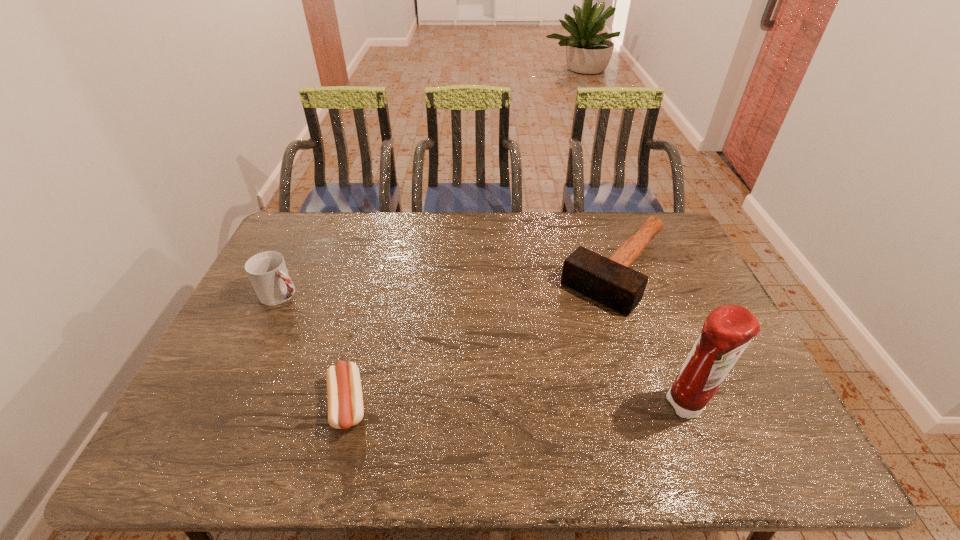
In order to click on vacant space located on the striking face of the second shortest object in this screenshot , I will do `click(531, 368)`.

The height and width of the screenshot is (540, 960). I want to click on free location located 0.390m on the side of the third shortest object where the handle is located, so click(396, 356).

The image size is (960, 540). I want to click on vacant space situated on the side of the third shortest object where the handle is located, so click(x=324, y=315).

The width and height of the screenshot is (960, 540). I want to click on vacant area situated 0.090m on the side of the third shortest object where the handle is located, so click(x=319, y=312).

I want to click on object that is positioned at the far edge, so click(609, 281).

I want to click on sausage located at the near edge, so point(344,392).

Locate an element on the screen. condiment located in the near edge section of the desktop is located at coordinates (727, 331).

Image resolution: width=960 pixels, height=540 pixels. Identify the location of object at the left edge. (267, 271).

Locate an element on the screen. This screenshot has height=540, width=960. condiment that is at the right edge is located at coordinates (727, 331).

The image size is (960, 540). I want to click on mallet that is at the right edge, so click(609, 281).